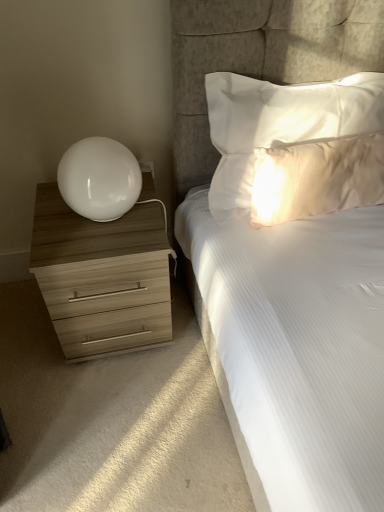
The image size is (384, 512). I want to click on vacant space to the left of white glossy table lamp at left, so click(48, 220).